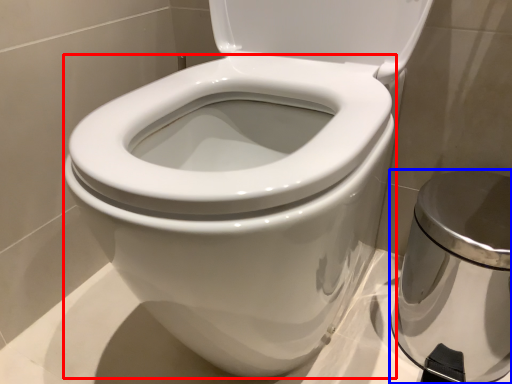
Question: Which object appears farthest to the camera in this image, bidet (highlighted by a red box) or porcelain (highlighted by a blue box)?

Choices:
 (A) bidet
 (B) porcelain

Answer: (B)